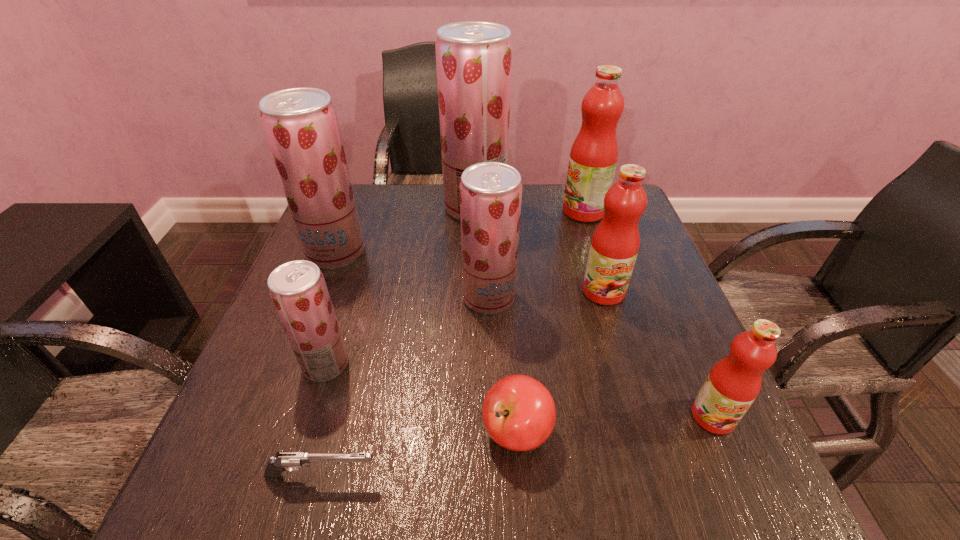
Identify which pink fruit juice is the second nearest to the red apple. Please provide its 2D coordinates. Your answer should be formatted as a tuple, i.e. [(x, y)], where the tuple contains the x and y coordinates of a point satisfying the conditions above.

[(615, 243)]

Where is `vacant position in the image that satisfies the following two spatial constraints: 1. on the front side of the red apple; 2. on the left side of the second smallest strawberry fruit juice`? vacant position in the image that satisfies the following two spatial constraints: 1. on the front side of the red apple; 2. on the left side of the second smallest strawberry fruit juice is located at coordinates (492, 432).